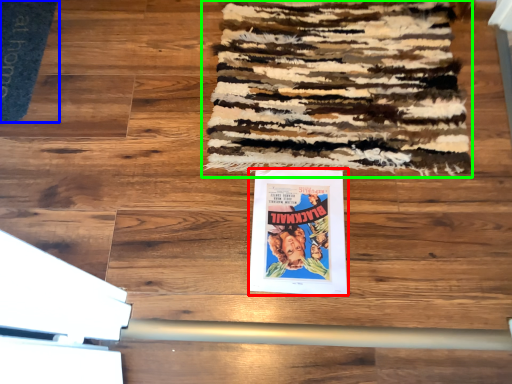
Question: Considering the real-world distances, which object is closest to poster (highlighted by a red box)? doormat (highlighted by a blue box) or mat (highlighted by a green box).

Choices:
 (A) doormat
 (B) mat

Answer: (B)